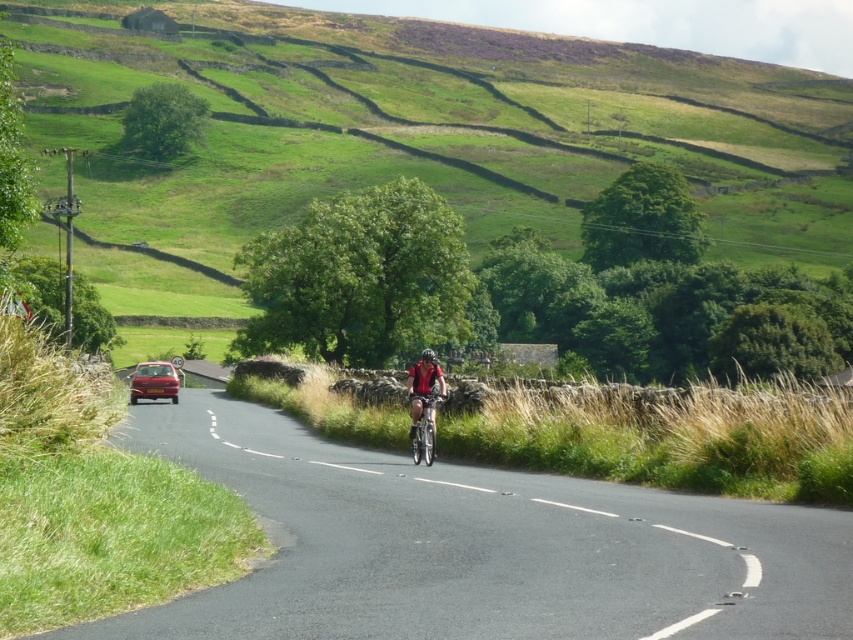
Between black asphalt road at center and red fabric cyclist at center, which one is positioned higher?

Positioned higher is red fabric cyclist at center.

Is the position of black asphalt road at center more distant than that of red fabric cyclist at center?

No, black asphalt road at center is in front of red fabric cyclist at center.

Find the location of a particular element. Image resolution: width=853 pixels, height=640 pixels. black asphalt road at center is located at coordinates (480, 547).

Is red fabric cyclist at center positioned behind metallic silver bicycle at center?

Yes.

From the picture: Who is positioned more to the right, red fabric cyclist at center or metallic silver bicycle at center?

metallic silver bicycle at center is more to the right.

You are a GUI agent. You are given a task and a screenshot of the screen. Output one action in this format:
    pyautogui.click(x=<x>, y=<y>)
    Task: Click on the red fabric cyclist at center
    The image size is (853, 640).
    Given the screenshot: What is the action you would take?
    pyautogui.click(x=422, y=387)

Locate an element on the screen. This screenshot has width=853, height=640. red fabric cyclist at center is located at coordinates (422, 387).

Is point (421, 358) more distant than point (428, 353)?

Yes, point (421, 358) is behind point (428, 353).

Which of these two, red fabric cyclist at center or black matte helmet at center, stands shorter?

black matte helmet at center

Who is more distant from viewer, (415, 364) or (426, 358)?

Positioned behind is point (415, 364).

This screenshot has height=640, width=853. I want to click on red fabric cyclist at center, so click(422, 387).